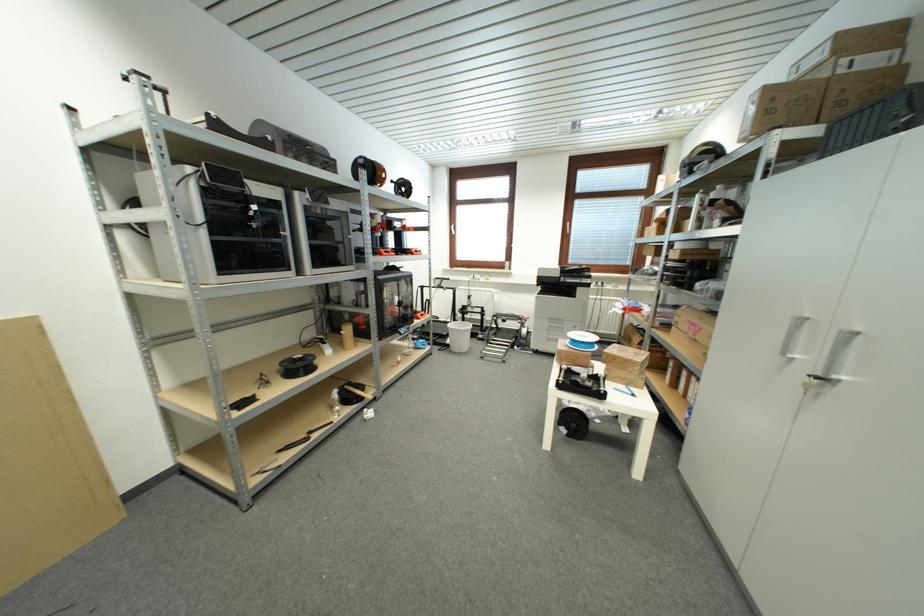
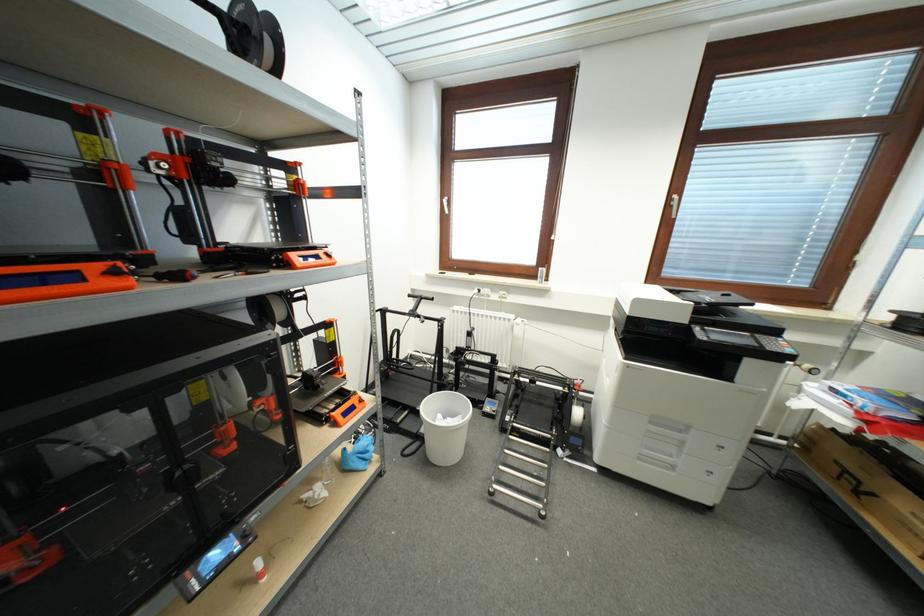
Where in the second image is the point corresponding to point 453,344 from the first image?

(427, 434)